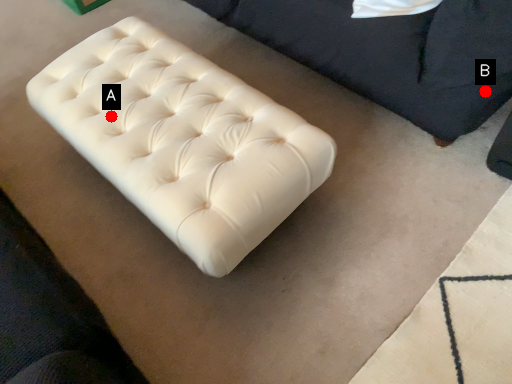
Question: Two points are circled on the image, labeled by A and B beside each circle. Which of the following is the farthest from the observer?

Choices:
 (A) A is further
 (B) B is further

Answer: (A)